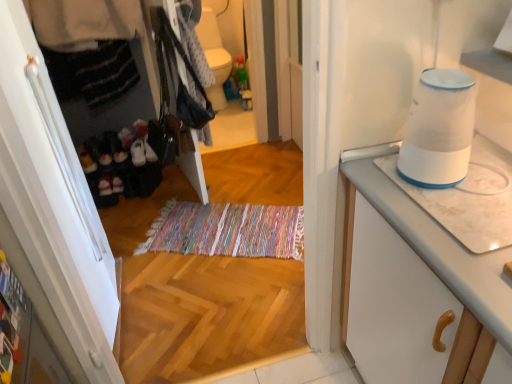
Image resolution: width=512 pixels, height=384 pixels. Identify the location of vacant space situated above white marble countertop at right (from a real-world perspective). (464, 201).